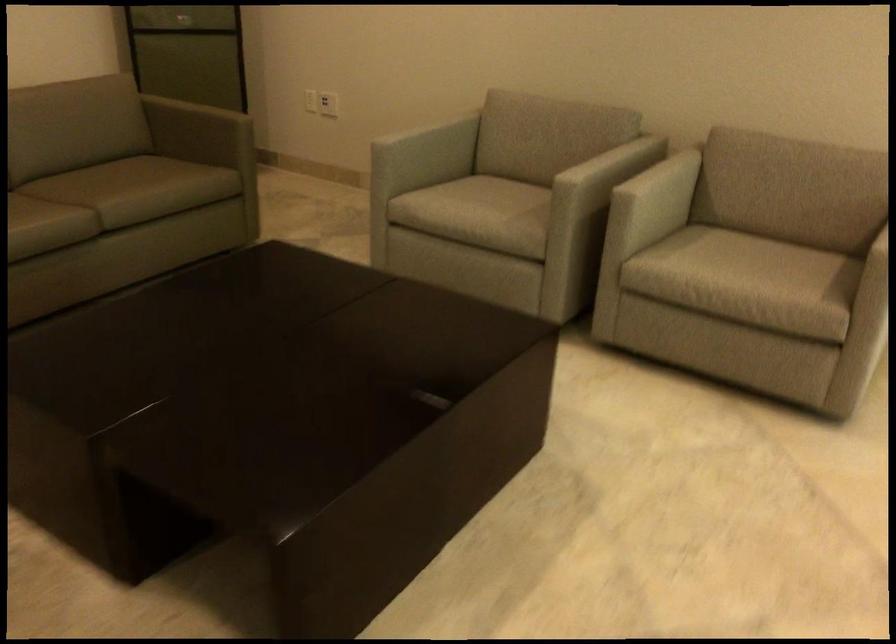
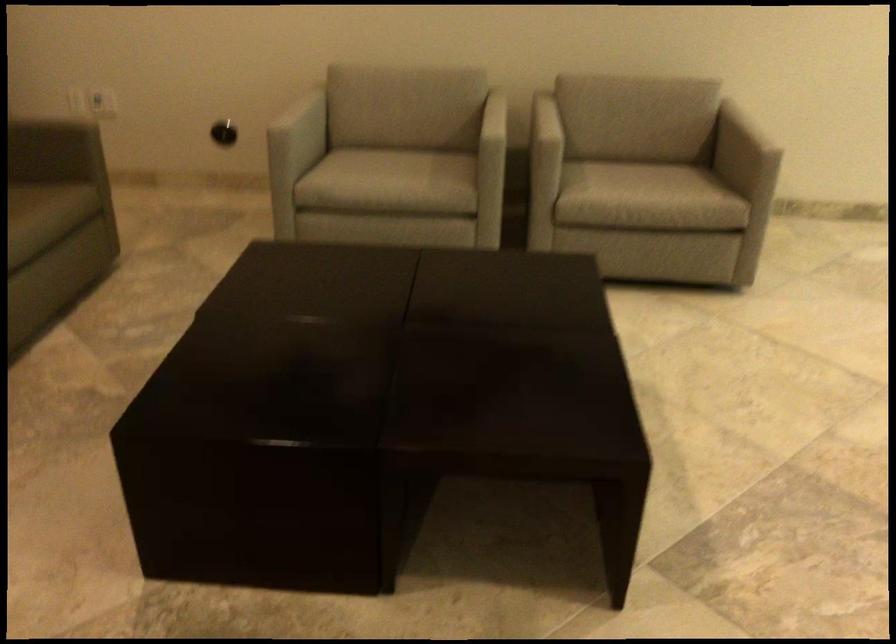
Find the pixel in the second image that matches the point at 555,202 in the first image.

(492, 151)